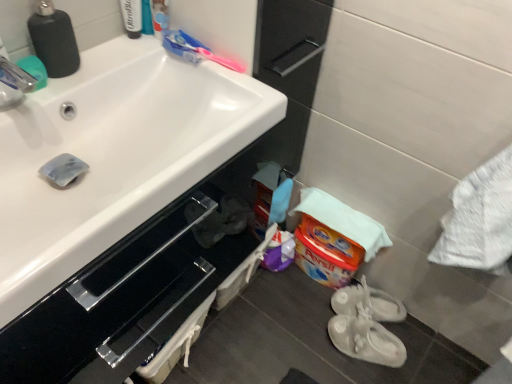
Find the location of a particular element. The height and width of the screenshot is (384, 512). free location to the left of pink plastic toothbrush at upper center is located at coordinates (149, 71).